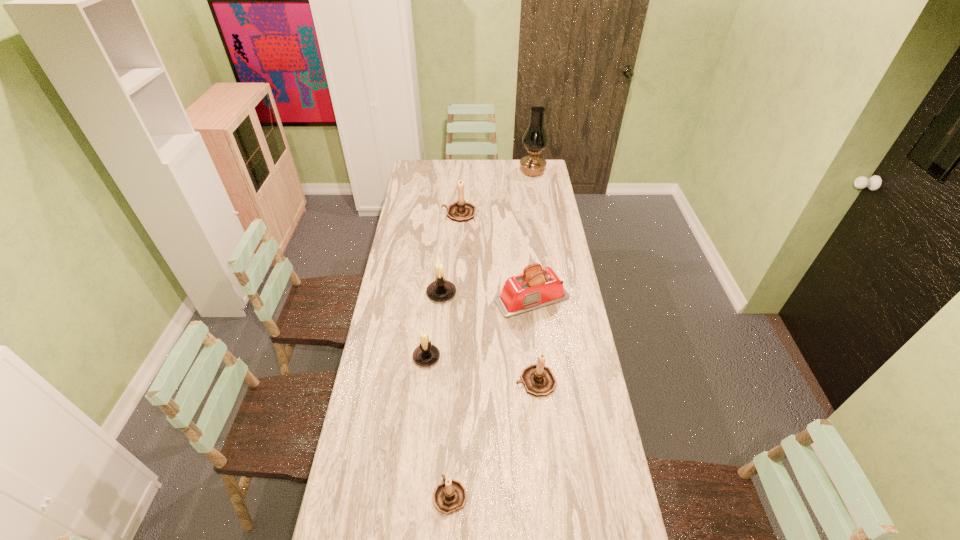
The image size is (960, 540). I want to click on free location that satisfies the following two spatial constraints: 1. on the front side of the smallest brown candle holder; 2. on the right side of the smaller white candle holder, so click(x=412, y=495).

The height and width of the screenshot is (540, 960). I want to click on blank space that satisfies the following two spatial constraints: 1. on the back side of the red toaster; 2. on the right side of the nearest candle holder, so click(459, 299).

This screenshot has width=960, height=540. I want to click on vacant position in the image that satisfies the following two spatial constraints: 1. on the back side of the farthest candle holder; 2. on the right side of the bigger white candle holder, so click(448, 213).

At what (x,y) coordinates should I click in order to perform the action: click on free space that satisfies the following two spatial constraints: 1. on the front side of the second farthest brown candle holder; 2. on the right side of the fourth nearest candle holder. Please return your answer as a coordinate pair (x, y). This screenshot has width=960, height=540. Looking at the image, I should click on (434, 381).